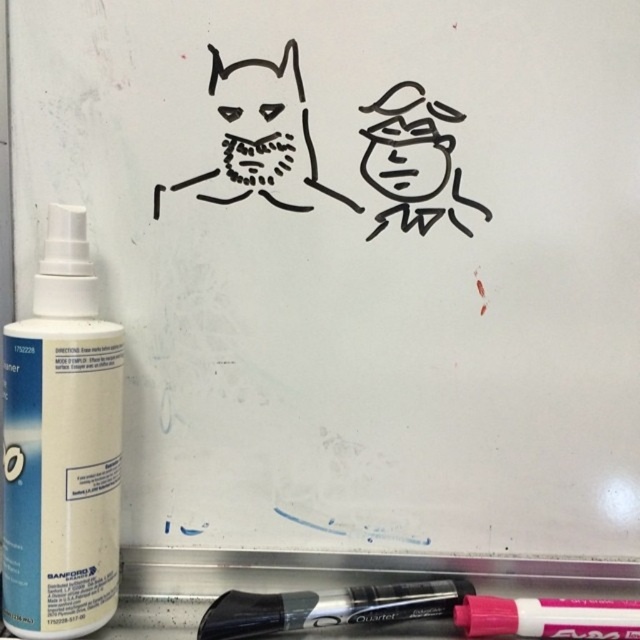
Question: Which object is closer to the camera taking this photo?

Choices:
 (A) black matte marker at lower center
 (B) white plastic spray bottle at left

Answer: (B)

Question: Can you confirm if white plastic spray bottle at left is bigger than black matte marker at lower center?

Choices:
 (A) no
 (B) yes

Answer: (B)

Question: Can you confirm if white plastic spray bottle at left is positioned to the right of black matte marker at lower center?

Choices:
 (A) yes
 (B) no

Answer: (B)

Question: Which point is closer to the camera taking this photo?

Choices:
 (A) (250, 596)
 (B) (113, 442)

Answer: (B)

Question: Is white plastic spray bottle at left wider than black matte marker at lower center?

Choices:
 (A) no
 (B) yes

Answer: (A)

Question: Which object is closer to the camera taking this photo?

Choices:
 (A) white plastic spray bottle at left
 (B) black matte marker at lower center

Answer: (A)